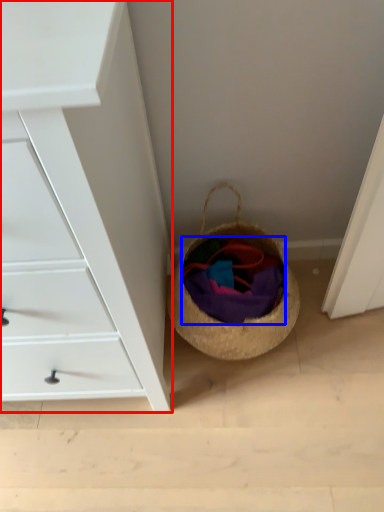
Question: Among these objects, which one is farthest to the camera, chest of drawers (highlighted by a red box) or clothing (highlighted by a blue box)?

Choices:
 (A) chest of drawers
 (B) clothing

Answer: (B)